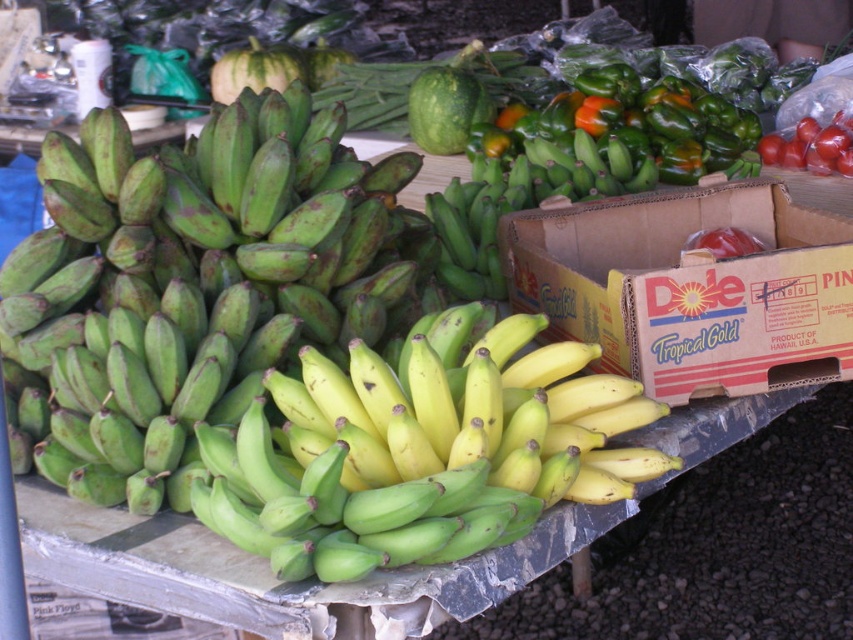
Is green matte bananas at left below shiny red tomatoes at upper right?

Indeed, green matte bananas at left is positioned under shiny red tomatoes at upper right.

Can you confirm if green matte bananas at left is smaller than shiny red tomatoes at upper right?

Actually, green matte bananas at left might be larger than shiny red tomatoes at upper right.

This screenshot has height=640, width=853. I want to click on green matte bananas at left, so click(x=192, y=284).

Where is `green matte bananas at left`? Image resolution: width=853 pixels, height=640 pixels. green matte bananas at left is located at coordinates (192, 284).

Can you confirm if cardboard box at right is taller than shiny red tomatoes at upper right?

Correct, cardboard box at right is much taller as shiny red tomatoes at upper right.

Does point (630, 236) lie in front of point (821, 145)?

Yes, point (630, 236) is in front of point (821, 145).

Where is `cardboard box at right`? The height and width of the screenshot is (640, 853). cardboard box at right is located at coordinates (689, 288).

Is green matte bananas at left bigger than green matte bananas at center?

Indeed, green matte bananas at left has a larger size compared to green matte bananas at center.

Is point (166, 410) farther from camera compared to point (517, 321)?

No, (166, 410) is in front of (517, 321).

Find the location of a particular element. This screenshot has width=853, height=640. green matte bananas at left is located at coordinates (192, 284).

What are the coordinates of `green matte bananas at left` in the screenshot? It's located at (192, 284).